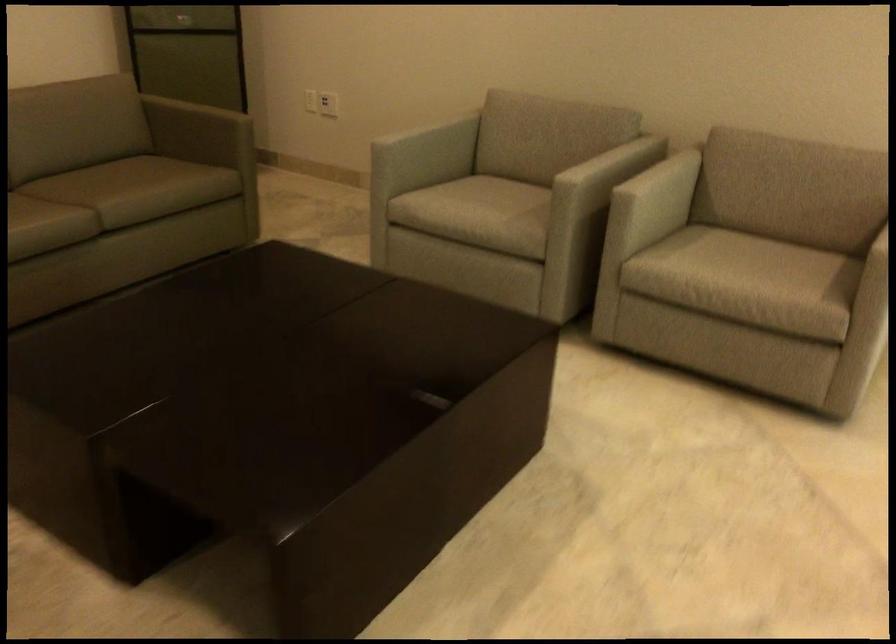
What do you see at coordinates (145, 187) in the screenshot? I see `the green sofa sitting surface` at bounding box center [145, 187].